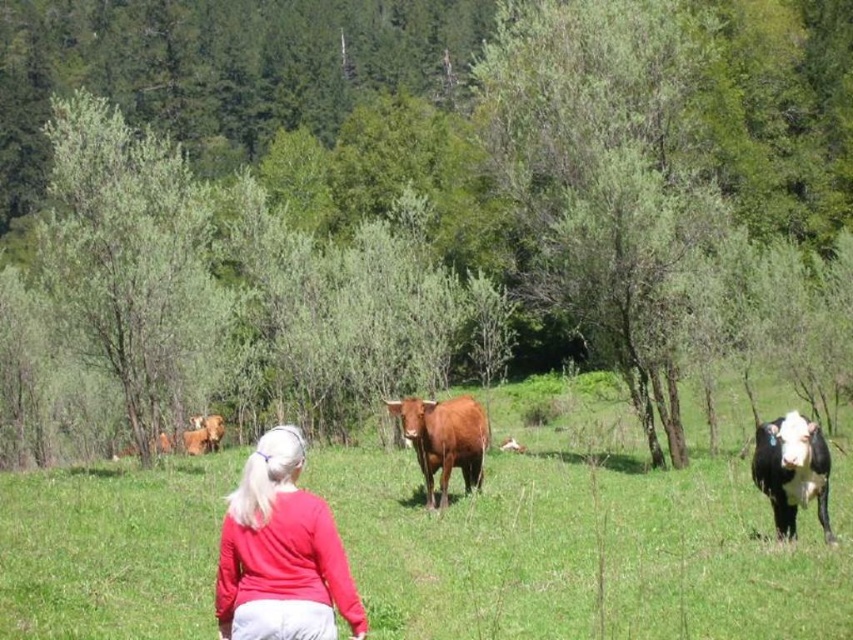
You are standing at the point marked by the coordinates point (402, 204) in the image. Looking around, what large natural feature are you standing on?

The point (402, 204) is on green leafy tree at center, so you are standing on the green leafy tree at center.